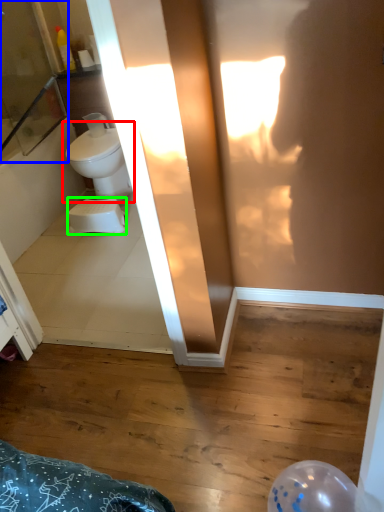
Question: Estimate the real-world distances between objects in this image. Which object is farther from toilet (highlighted by a red box), screen door (highlighted by a blue box) or toilet bowl (highlighted by a green box)?

Choices:
 (A) screen door
 (B) toilet bowl

Answer: (A)